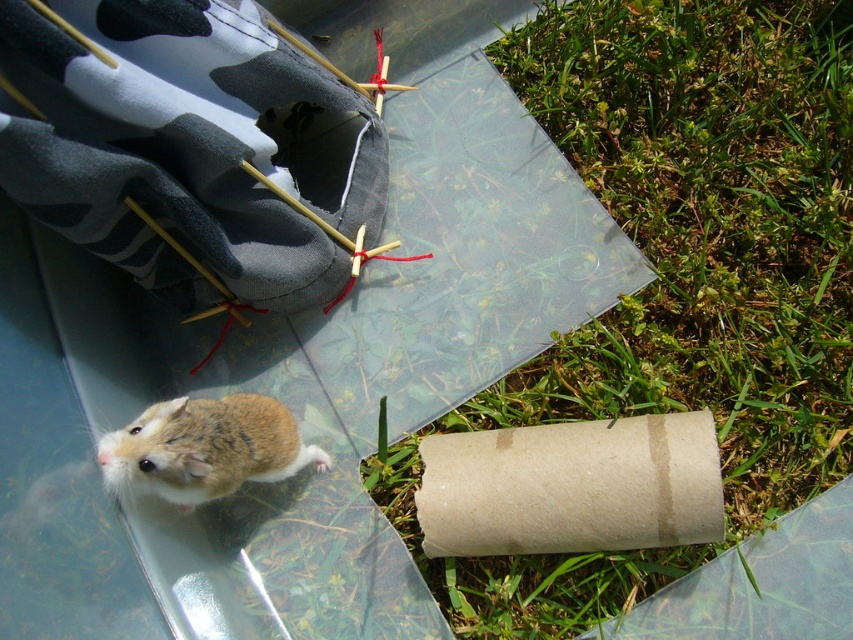
Question: Which point is closer to the camera?

Choices:
 (A) brown fur hamster at lower left
 (B) green grass at lower right

Answer: (A)

Question: Is brown cardboard tube at lower right bigger than brown fur hamster at lower left?

Choices:
 (A) yes
 (B) no

Answer: (B)

Question: Is green grass at lower right positioned before brown cardboard tube at lower right?

Choices:
 (A) no
 (B) yes

Answer: (A)

Question: Is the position of brown cardboard tube at lower right less distant than that of brown fur hamster at lower left?

Choices:
 (A) no
 (B) yes

Answer: (A)

Question: Which point is closer to the camera taking this photo?

Choices:
 (A) (294, 468)
 (B) (608, 444)

Answer: (B)

Question: Which object is the farthest from the brown cardboard tube at lower right?

Choices:
 (A) green grass at lower right
 (B) brown fur hamster at lower left

Answer: (B)